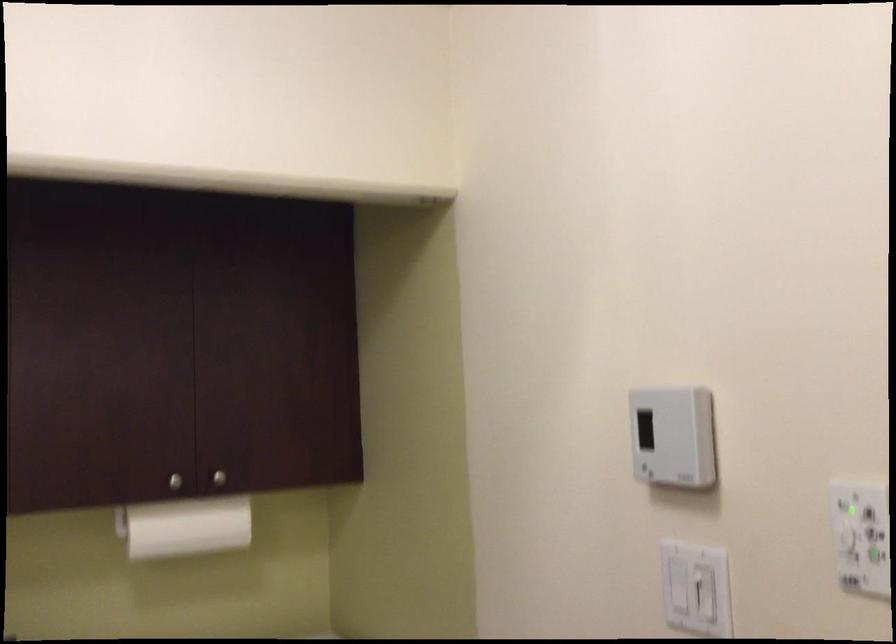
Where would you push the white light switch? Please return your answer as a coordinate pair (x, y).

(695, 588)